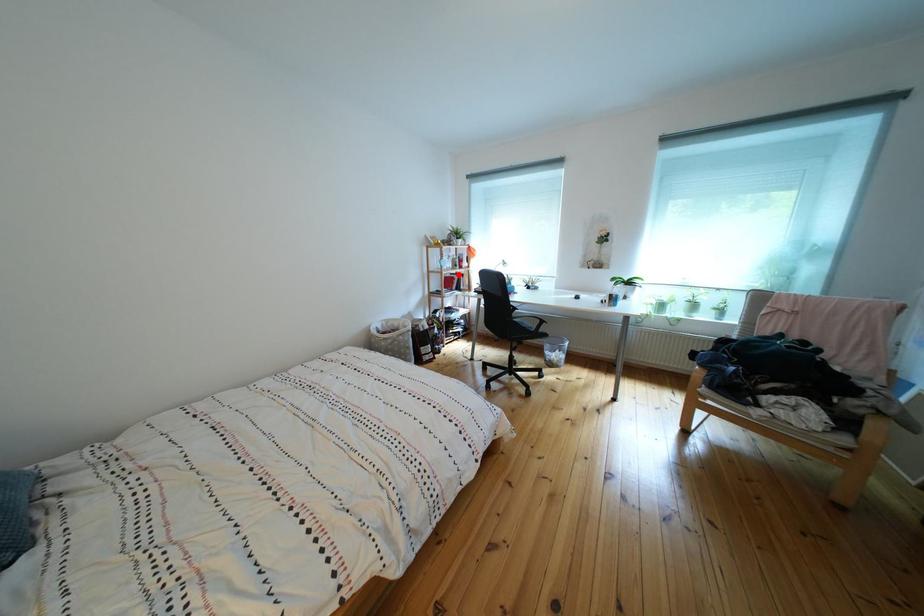
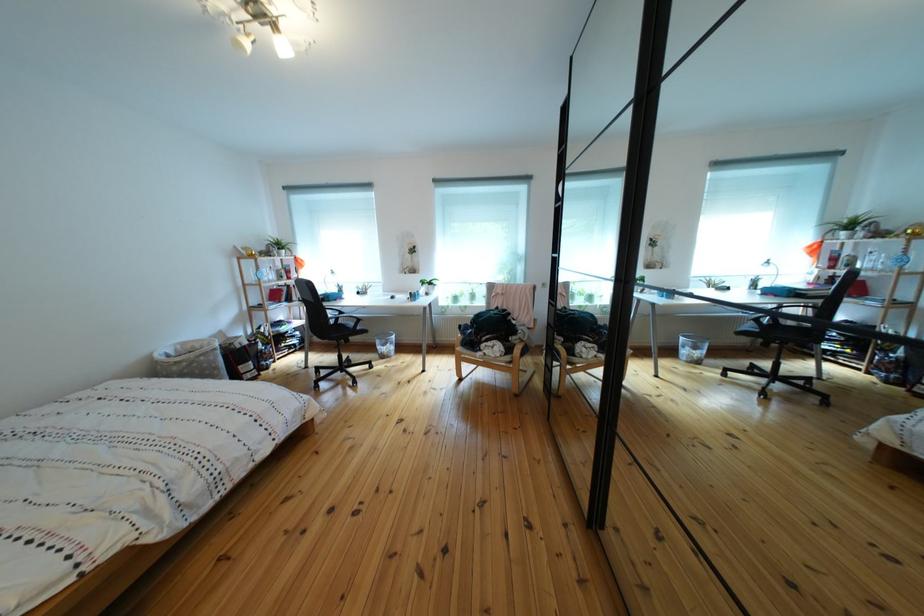
Question: I am providing you with two images of the same scene from different viewpoints. A red point is shown in image1. For the corresponding object point in image2, is it positioned nearer or farther from the camera?

Choices:
 (A) Nearer
 (B) Farther

Answer: (B)